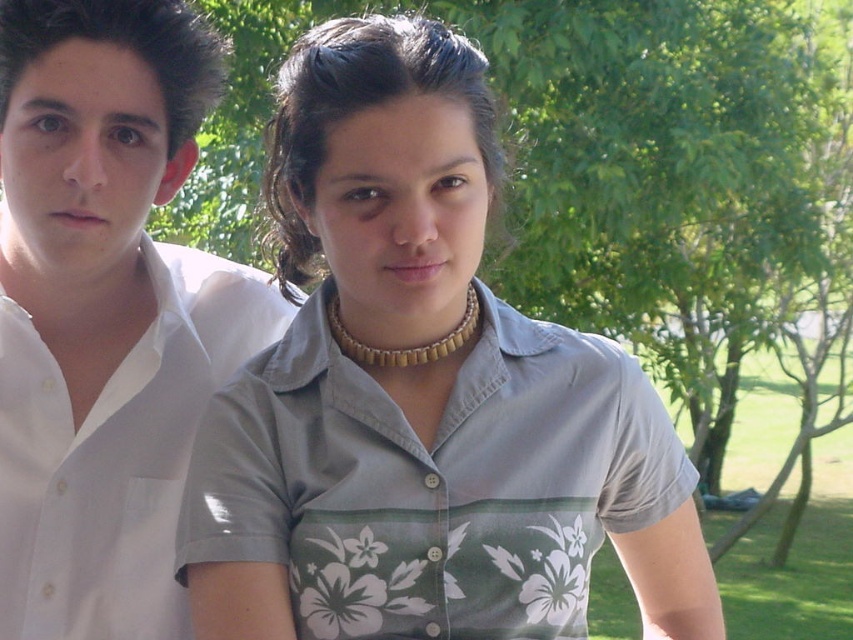
You are a photographer trying to capture a photo of two people. You see the gray fabric shirt at center and the white cotton shirt at left. Which person should you move to the right to ensure both are centered in the frame?

The white cotton shirt at left should be moved to the right because the gray fabric shirt at center is already positioned to its right, so shifting the white cotton shirt at left towards the right would help align both subjects centrally in the frame.

You are a photographer taking a picture of two people wearing the gray fabric shirt at center and the white cotton shirt at left. Which person should you adjust the framing to focus on if you want to highlight the wider clothing item?

You should focus on the gray fabric shirt at center because its width is larger than the white cotton shirt at left, making it the wider clothing item to highlight.

You are a photographer trying to capture a clear shot of the gray fabric shirt at center and the white cotton shirt at left. Since both are in the same frame, which one will be more visible in the photo?

The gray fabric shirt at center will be more visible because it is in front of the white cotton shirt at left.